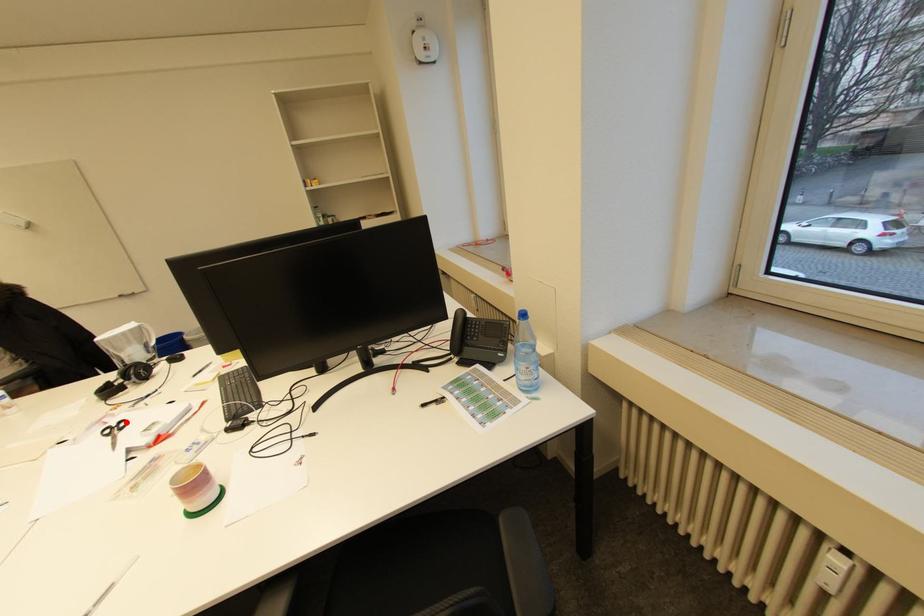
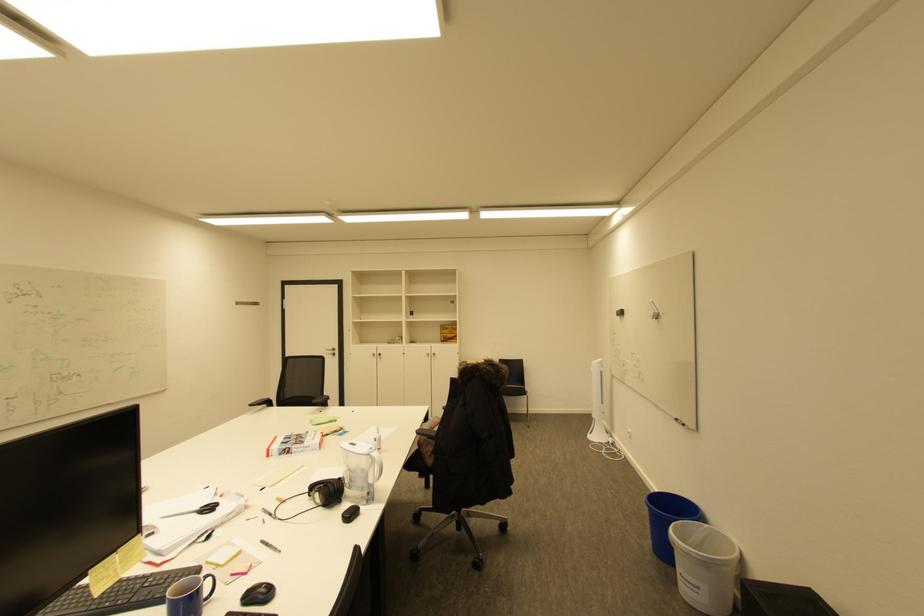
Find the pixel in the second image that matches the highlighted location in the first image.

(220, 508)